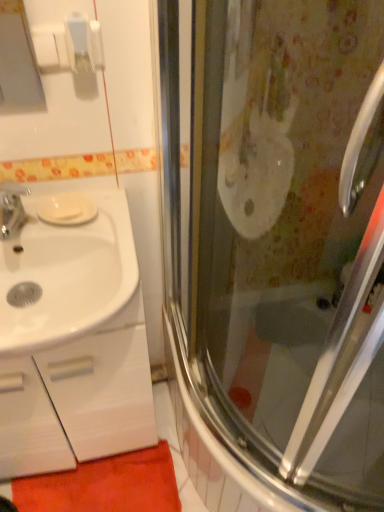
Question: From a real-world perspective, is orange carpet at lower left physically located above or below white matte soap at left?

Choices:
 (A) below
 (B) above

Answer: (A)

Question: Based on their sizes in the image, would you say orange carpet at lower left is bigger or smaller than white matte soap at left?

Choices:
 (A) big
 (B) small

Answer: (A)

Question: Based on their relative distances, which object is farther from the white glossy cabinet at left?

Choices:
 (A) white matte soap at left
 (B) transparent glass shower door at right
 (C) white glossy sink at left
 (D) orange carpet at lower left

Answer: (A)

Question: Which is nearer to the white glossy cabinet at left?

Choices:
 (A) orange carpet at lower left
 (B) transparent glass shower door at right
 (C) white glossy sink at left
 (D) white matte soap at left

Answer: (A)